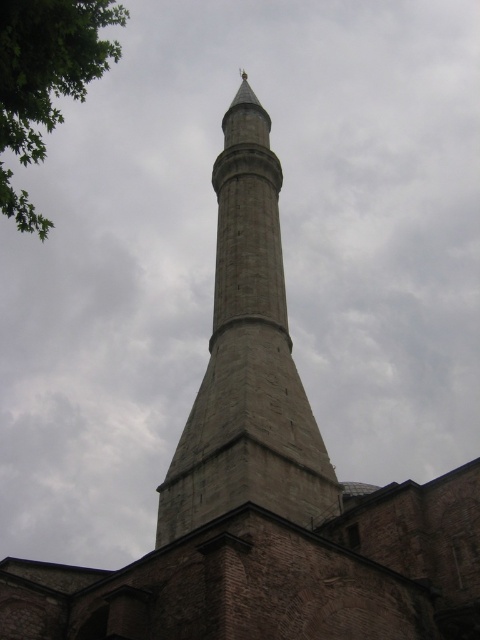
Who is shorter, gray stone minaret at center or green leafy tree at upper left?

Standing shorter between the two is gray stone minaret at center.

Does gray stone minaret at center have a greater width compared to green leafy tree at upper left?

Incorrect, gray stone minaret at center's width does not surpass green leafy tree at upper left's.

Describe the element at coordinates (248, 360) in the screenshot. The height and width of the screenshot is (640, 480). I see `gray stone minaret at center` at that location.

Find the location of a particular element. gray stone minaret at center is located at coordinates (248, 360).